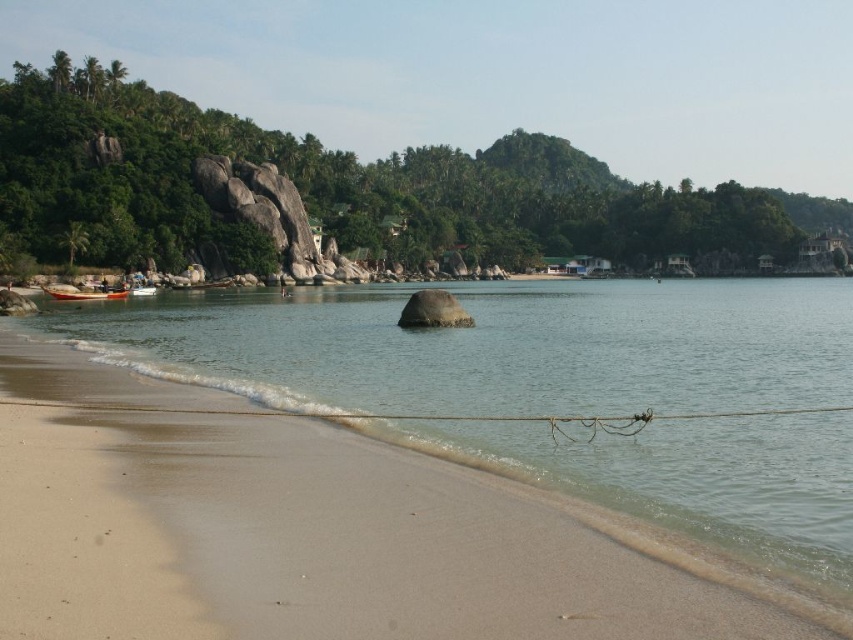
Question: Is clear water at beach front wider than wooden boat at lower left?

Choices:
 (A) no
 (B) yes

Answer: (B)

Question: Can you confirm if clear water at beach front is smaller than wooden boat at lower left?

Choices:
 (A) yes
 (B) no

Answer: (B)

Question: Which point is closer to the camera taking this photo?

Choices:
 (A) (564, 330)
 (B) (99, 300)

Answer: (A)

Question: From the image, what is the correct spatial relationship of clear water at beach front in relation to wooden boat at lower left?

Choices:
 (A) right
 (B) left

Answer: (A)

Question: Among these objects, which one is nearest to the camera?

Choices:
 (A) wooden boat at lower left
 (B) clear water at beach front

Answer: (B)